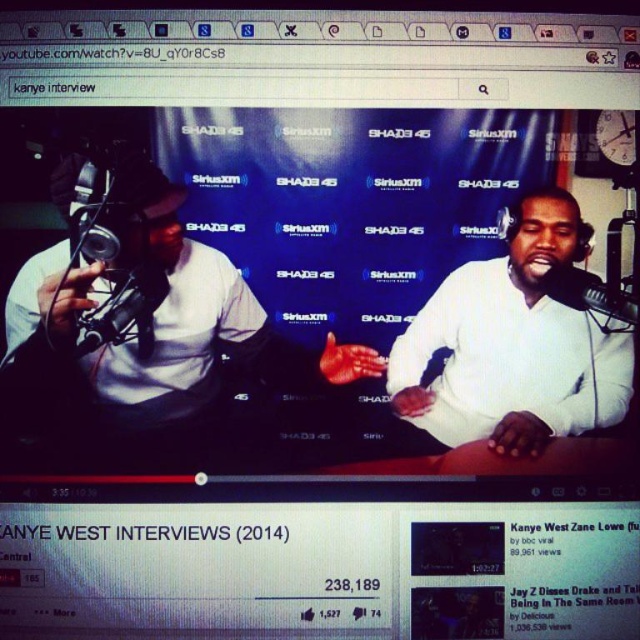
Where is `matte white shirt at left`? This screenshot has height=640, width=640. matte white shirt at left is located at coordinates (154, 333).

Does matte white shirt at left appear on the left side of white matte shirt at right?

Indeed, matte white shirt at left is positioned on the left side of white matte shirt at right.

Is point (72, 403) positioned after point (419, 344)?

That is False.

This screenshot has height=640, width=640. I want to click on matte white shirt at left, so click(x=154, y=333).

Is point (195, 323) farther from viewer compared to point (579, 296)?

Yes, point (195, 323) is farther from viewer.

Is matte white shirt at left thinner than black matte microphone at right?

Incorrect, matte white shirt at left's width is not less than black matte microphone at right's.

Is point (164, 284) in front of point (612, 314)?

That is False.

You are a GUI agent. You are given a task and a screenshot of the screen. Output one action in this format:
    pyautogui.click(x=<x>, y=<y>)
    Task: Click on the matte white shirt at left
    This screenshot has width=640, height=640.
    Given the screenshot: What is the action you would take?
    pyautogui.click(x=154, y=333)

Does white matte shirt at right appear on the right side of black matte microphone at right?

No, white matte shirt at right is not to the right of black matte microphone at right.

Is white matte shirt at right wider than black matte microphone at right?

Yes, white matte shirt at right is wider than black matte microphone at right.

Is point (483, 371) positioned in front of point (556, 296)?

No.

Locate an element on the screen. white matte shirt at right is located at coordinates (513, 344).